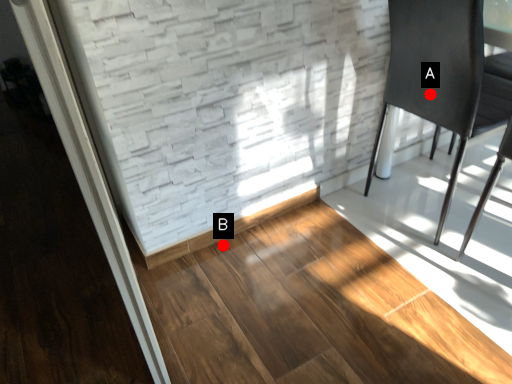
Question: Two points are circled on the image, labeled by A and B beside each circle. Which point is closer to the camera taking this photo?

Choices:
 (A) A is closer
 (B) B is closer

Answer: (A)